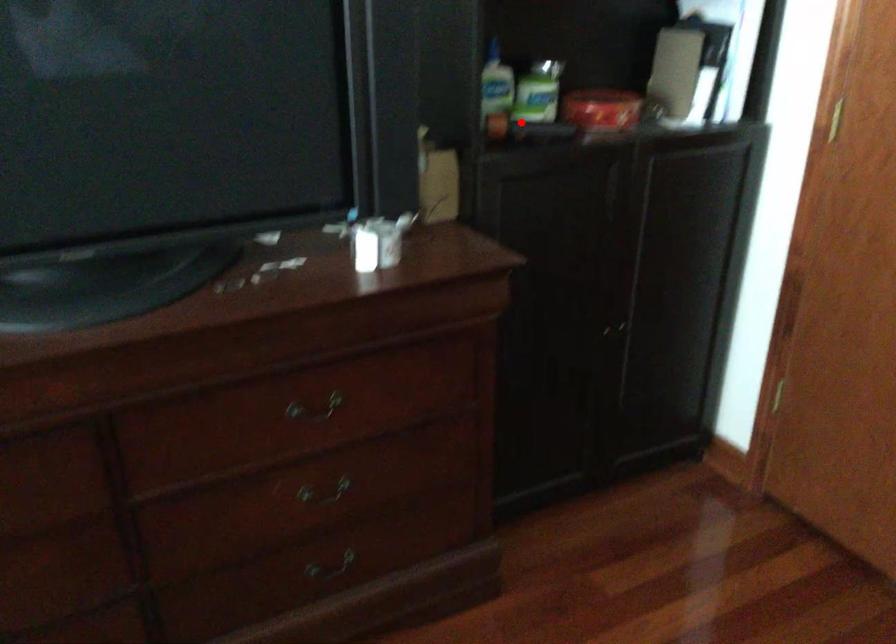
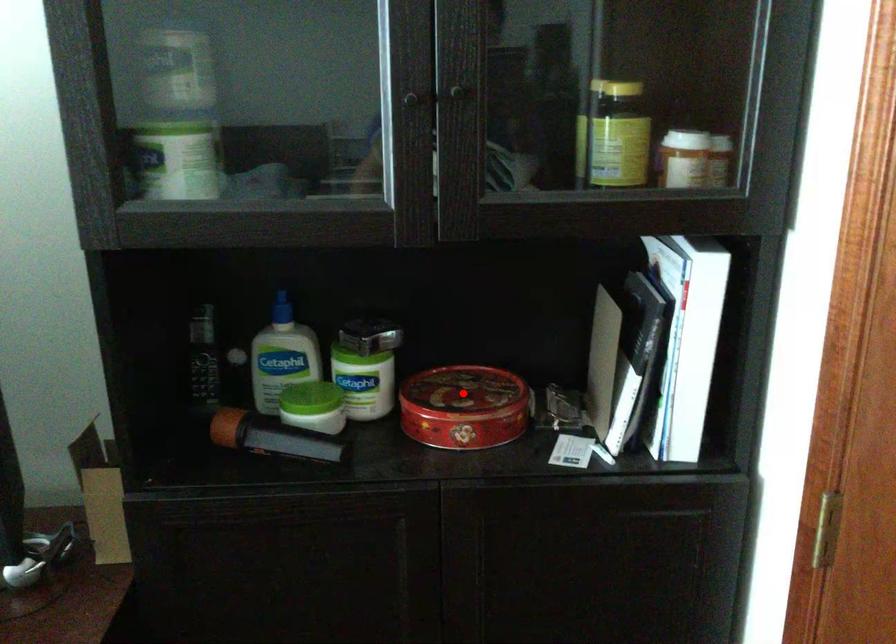
I am providing you with two images of the same scene from different viewpoints. A red point is marked on the first image and another point is marked on the second image. Do the highlighted points in image1 and image2 indicate the same real-world spot?

No